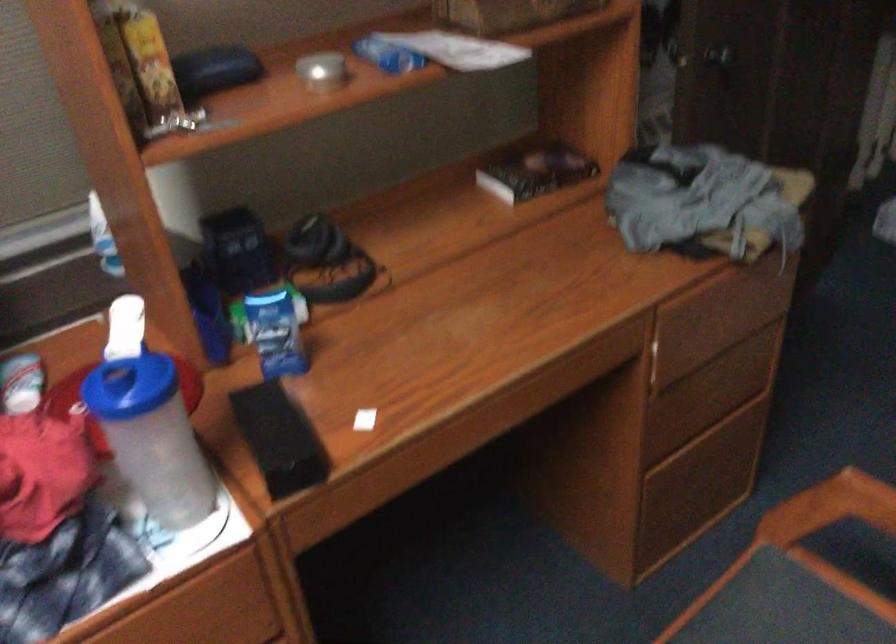
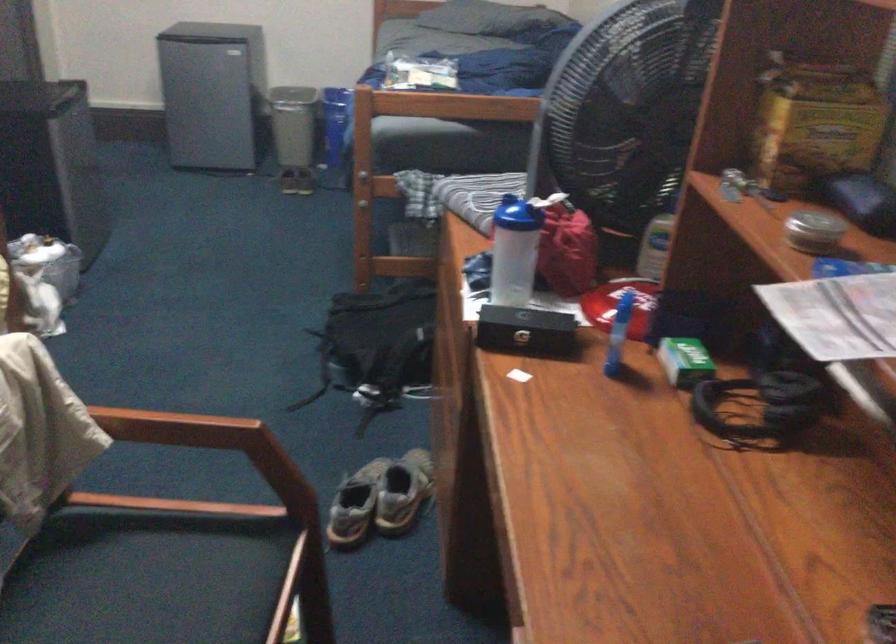
In the second image, find the point that corresponds to point 152,419 in the first image.

(513, 251)